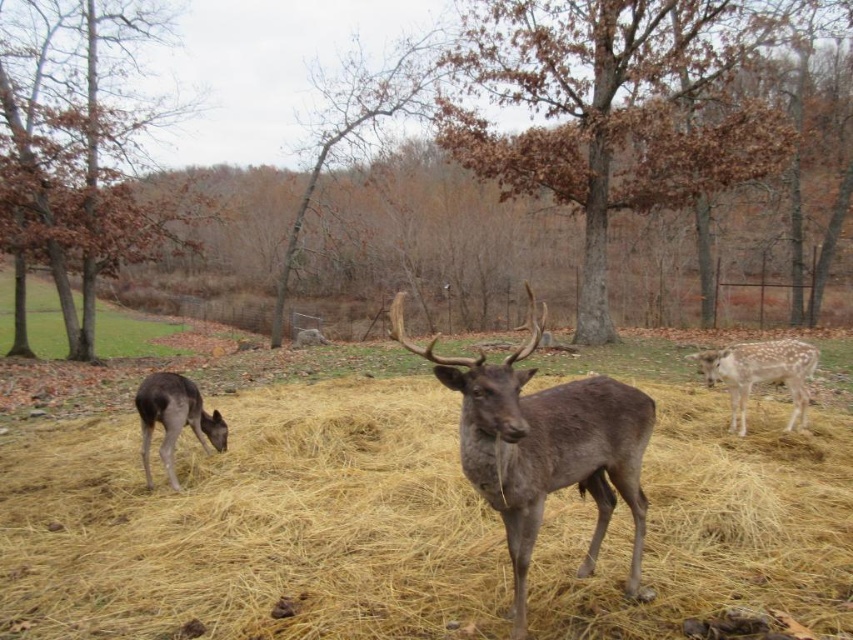
Question: Which point appears closest to the camera in this image?

Choices:
 (A) (780, 346)
 (B) (144, 452)
 (C) (28, 282)

Answer: (B)

Question: Considering the relative positions of gray matte/deer at center and gray matte deer at lower left in the image provided, where is gray matte/deer at center located with respect to gray matte deer at lower left?

Choices:
 (A) below
 (B) above

Answer: (B)

Question: Does gray matte/deer at center appear over gray matte deer at lower left?

Choices:
 (A) yes
 (B) no

Answer: (A)

Question: Which of the following is the closest to the observer?

Choices:
 (A) gray matte/deer at center
 (B) green grass at lower left
 (C) gray matte deer at lower left

Answer: (A)

Question: Which of the following is the farthest from the observer?

Choices:
 (A) (x=543, y=394)
 (B) (x=27, y=284)
 (C) (x=170, y=470)
 (D) (x=723, y=376)

Answer: (B)

Question: Does gray matte/deer at center have a greater width compared to spotted fur deer at right?

Choices:
 (A) no
 (B) yes

Answer: (B)